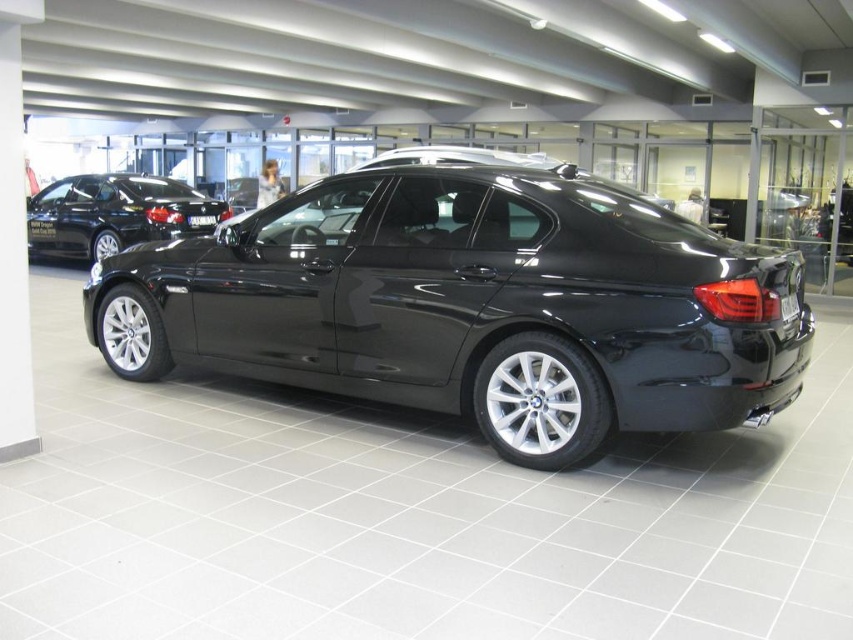
Question: Among these points, which one is farthest from the camera?

Choices:
 (A) (619, 268)
 (B) (175, 230)

Answer: (B)

Question: Is glossy black car at center further to camera compared to glossy black sedan at upper left?

Choices:
 (A) no
 (B) yes

Answer: (A)

Question: From the image, what is the correct spatial relationship of glossy black car at center in relation to glossy black sedan at upper left?

Choices:
 (A) below
 (B) above

Answer: (A)

Question: Among these objects, which one is farthest from the camera?

Choices:
 (A) glossy black sedan at upper left
 (B) glossy black car at center

Answer: (A)

Question: Does glossy black car at center have a larger size compared to glossy black sedan at upper left?

Choices:
 (A) yes
 (B) no

Answer: (A)

Question: Among these points, which one is farthest from the camera?

Choices:
 (A) (91, 182)
 (B) (469, 392)

Answer: (A)